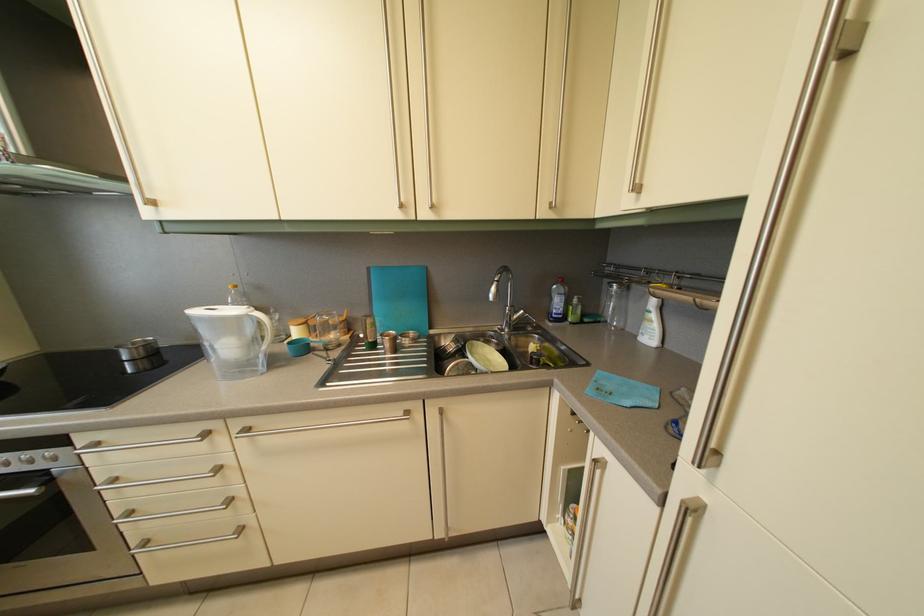
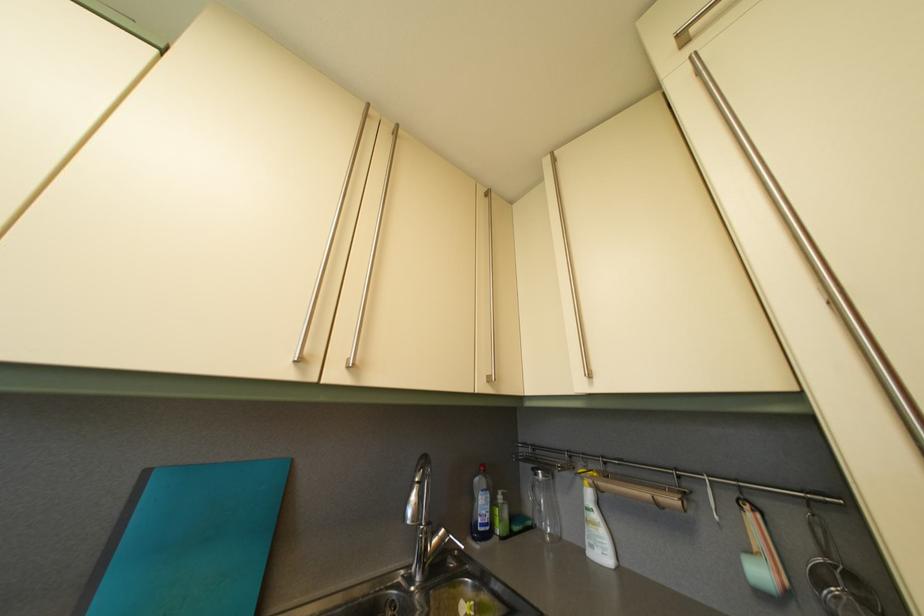
Where in the second image is the point corresponding to (530,318) from the first image?

(451, 539)